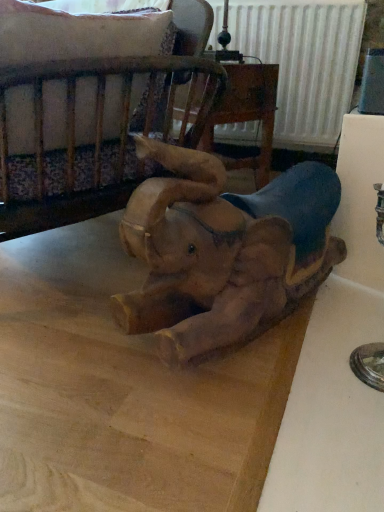
Where is `wooden elephant at center`? wooden elephant at center is located at coordinates (222, 250).

This screenshot has height=512, width=384. What do you see at coordinates (222, 250) in the screenshot?
I see `wooden elephant at center` at bounding box center [222, 250].

What do you see at coordinates (84, 114) in the screenshot? I see `wooden crib at upper left` at bounding box center [84, 114].

Identify the location of wooden crib at upper left. (84, 114).

Identify the location of wooden elephant at center. (222, 250).

Is wooden crib at upper left at the left side of wooden elephant at center?

Yes, wooden crib at upper left is to the left of wooden elephant at center.

Relative to wooden elephant at center, is wooden crib at upper left in front or behind?

wooden crib at upper left is behind wooden elephant at center.

Considering the positions of point (186, 120) and point (229, 327), is point (186, 120) closer or farther from the camera than point (229, 327)?

Point (186, 120) is farther from the camera than point (229, 327).

From the image's perspective, who appears lower, wooden crib at upper left or wooden elephant at center?

wooden elephant at center is shown below in the image.

From a real-world perspective, is wooden crib at upper left physically below wooden elephant at center?

Incorrect, from a real-world perspective, wooden crib at upper left is higher than wooden elephant at center.

Does wooden crib at upper left have a greater width compared to wooden elephant at center?

Correct, the width of wooden crib at upper left exceeds that of wooden elephant at center.

Who is shorter, wooden crib at upper left or wooden elephant at center?

wooden crib at upper left is shorter.

Does wooden crib at upper left have a larger size compared to wooden elephant at center?

No.

Does wooden crib at upper left contain wooden elephant at center?

No, wooden elephant at center is located outside of wooden crib at upper left.

Is there a large distance between wooden crib at upper left and wooden elephant at center?

No, wooden crib at upper left is in close proximity to wooden elephant at center.

Is wooden crib at upper left positioned with its back to wooden elephant at center?

That's right, wooden crib at upper left is facing away from wooden elephant at center.

How many degrees apart are the facing directions of wooden crib at upper left and wooden elephant at center?

The angle between the facing direction of wooden crib at upper left and the facing direction of wooden elephant at center is 1.82 degrees.

You are a GUI agent. You are given a task and a screenshot of the screen. Output one action in this format:
    pyautogui.click(x=<x>, y=<y>)
    Task: Click on the furniture that is behind the wooden elephant at center
    
    Given the screenshot: What is the action you would take?
    pyautogui.click(x=84, y=114)

Considering the relative positions of wooden elephant at center and wooden crib at upper left in the image provided, is wooden elephant at center to the right of wooden crib at upper left from the viewer's perspective?

Yes.

Considering their positions, is wooden elephant at center located in front of or behind wooden crib at upper left?

Clearly, wooden elephant at center is in front of wooden crib at upper left.

Considering the points (191, 259) and (85, 79), which point is behind, point (191, 259) or point (85, 79)?

The point (85, 79) is farther.

From the image's perspective, between wooden elephant at center and wooden crib at upper left, who is located below?

wooden elephant at center.

From a real-world perspective, is wooden elephant at center below wooden crib at upper left?

Indeed, from a real-world perspective, wooden elephant at center is positioned beneath wooden crib at upper left.

Between wooden elephant at center and wooden crib at upper left, which one has smaller width?

Thinner between the two is wooden elephant at center.

Who is taller, wooden elephant at center or wooden crib at upper left?

wooden elephant at center is taller.

Considering the relative sizes of wooden elephant at center and wooden crib at upper left in the image provided, is wooden elephant at center bigger than wooden crib at upper left?

Correct, wooden elephant at center is larger in size than wooden crib at upper left.

Would you say wooden elephant at center is inside or outside wooden crib at upper left?

wooden elephant at center is outside wooden crib at upper left.

Is wooden elephant at center next to wooden crib at upper left and touching it?

No, wooden elephant at center is not in contact with wooden crib at upper left.

From the picture: Is wooden elephant at center oriented away from wooden crib at upper left?

wooden elephant at center is not turned away from wooden crib at upper left.

Image resolution: width=384 pixels, height=512 pixels. I want to click on furniture that appears on the left of wooden elephant at center, so click(84, 114).

Find the location of a particular element. This screenshot has width=384, height=512. elephant located underneath the wooden crib at upper left (from a real-world perspective) is located at coordinates tap(222, 250).

At what (x,y) coordinates should I click in order to perform the action: click on furniture above the wooden elephant at center (from the image's perspective). Please return your answer as a coordinate pair (x, y). This screenshot has height=512, width=384. Looking at the image, I should click on (84, 114).